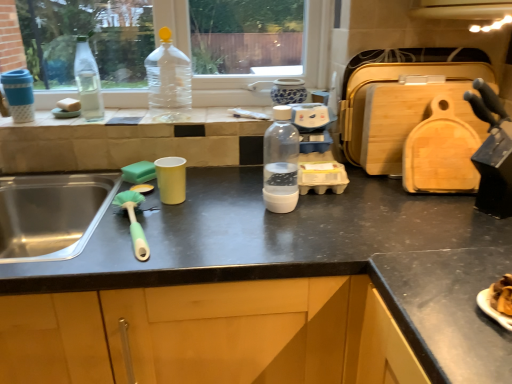
Where is `free spot in front of transparent plastic bottle at center, acting as the 3th bottle starting from the left`? free spot in front of transparent plastic bottle at center, acting as the 3th bottle starting from the left is located at coordinates (279, 236).